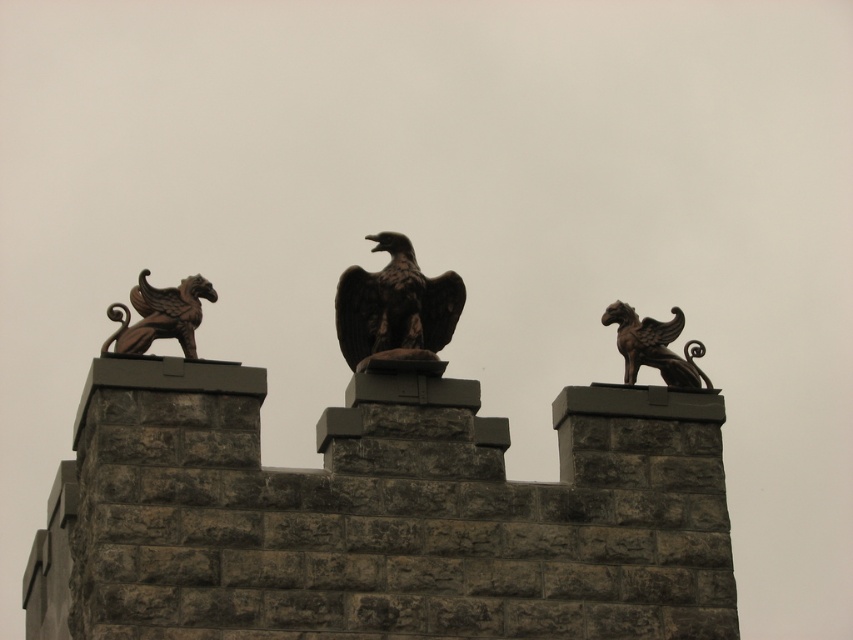
Question: Does dark brown stone eagle at center appear under bronze gryphon at right?

Choices:
 (A) yes
 (B) no

Answer: (B)

Question: Among these objects, which one is nearest to the camera?

Choices:
 (A) dark brown stone eagle at center
 (B) bronze gargoyle at left

Answer: (B)

Question: Can you confirm if dark brown stone eagle at center is smaller than bronze gargoyle at left?

Choices:
 (A) yes
 (B) no

Answer: (A)

Question: Which of the following is the closest to the observer?

Choices:
 (A) pyautogui.click(x=451, y=326)
 (B) pyautogui.click(x=192, y=308)

Answer: (B)

Question: Is bronze gargoyle at left bigger than bronze gryphon at right?

Choices:
 (A) no
 (B) yes

Answer: (B)

Question: Which object appears closest to the camera in this image?

Choices:
 (A) bronze gargoyle at left
 (B) dark brown stone eagle at center

Answer: (A)